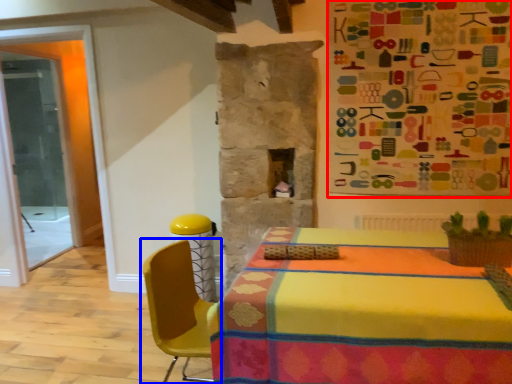
Question: Which point is closer to the camera, bulletin board (highlighted by a red box) or chair (highlighted by a blue box)?

Choices:
 (A) bulletin board
 (B) chair

Answer: (B)